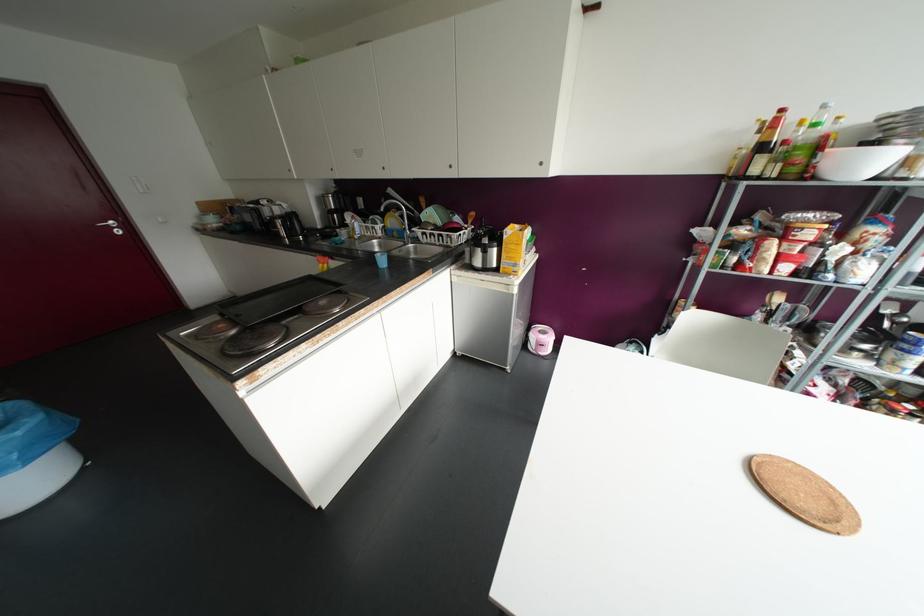
Identify the location of faucet handle. This screenshot has height=616, width=924. (412, 233).